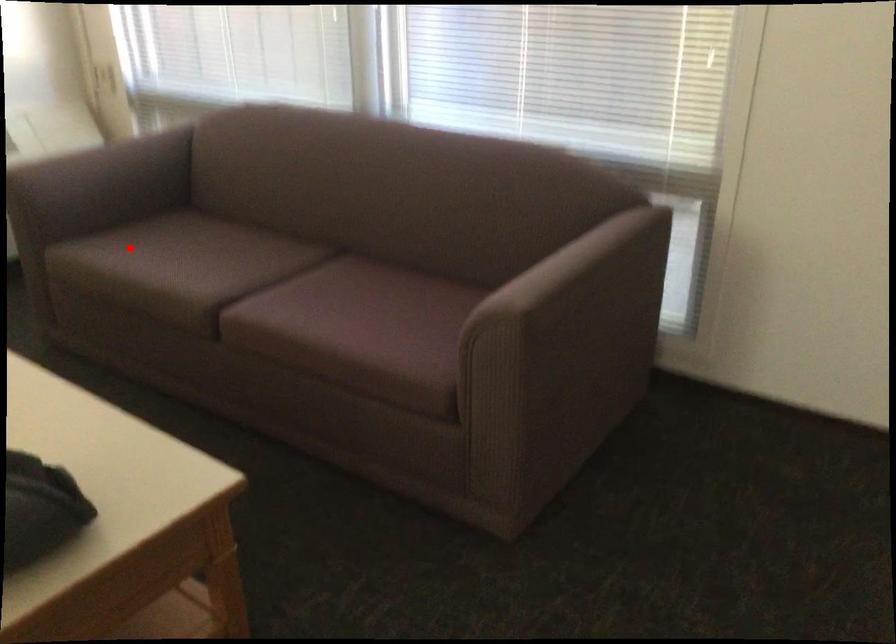
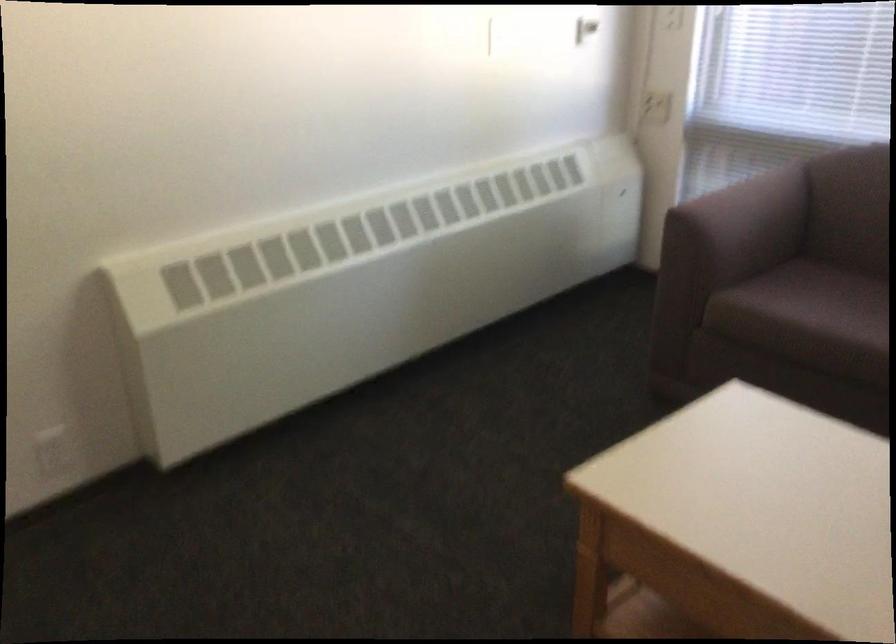
Find the pixel in the second image that matches the highlighted location in the first image.

(807, 303)